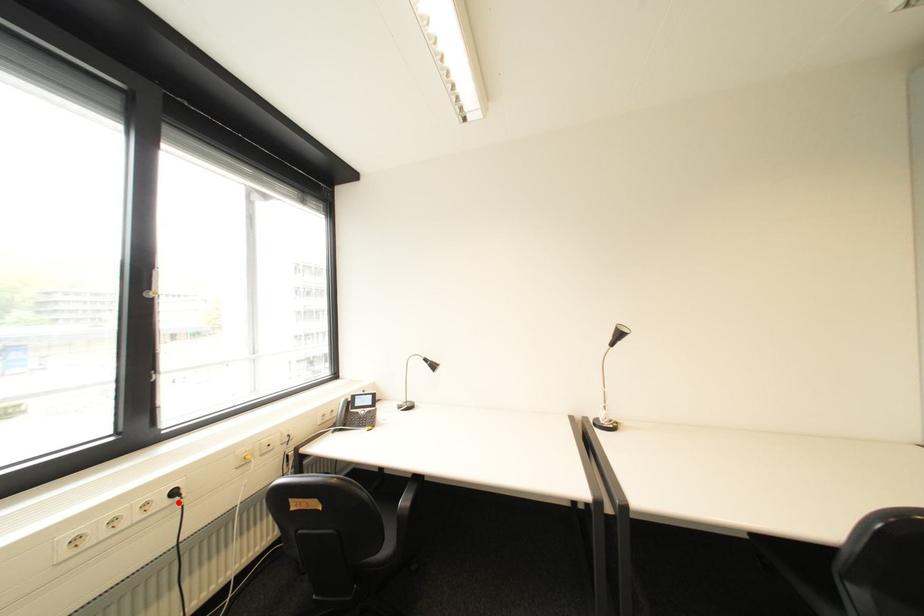
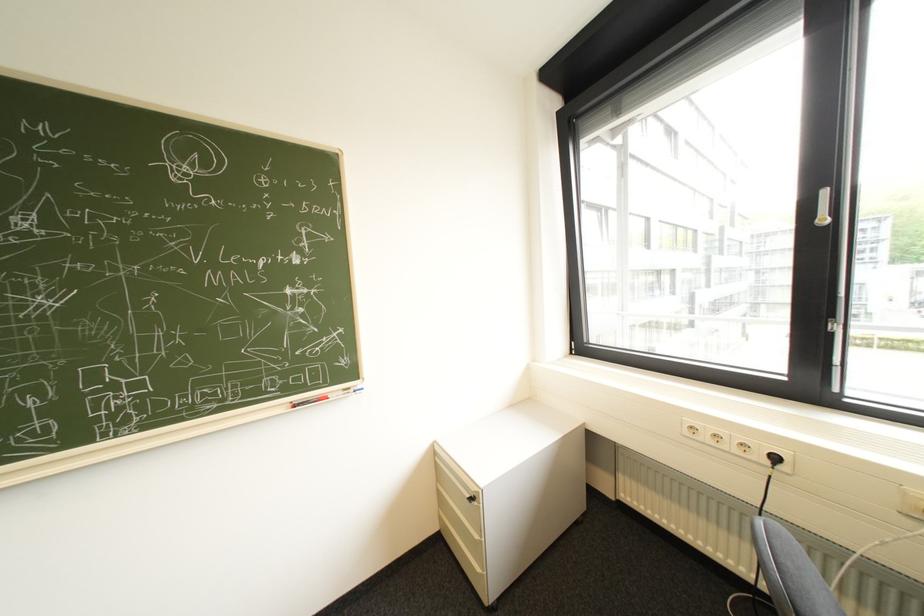
Locate, in the second image, the point that corresponds to the highlighted location in the first image.

(779, 463)